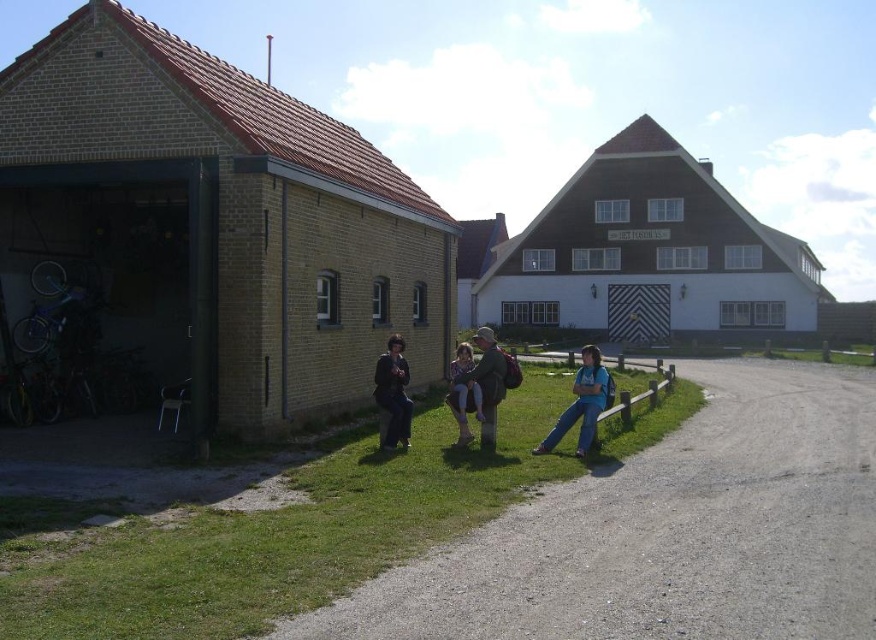
Is blue jeans at lower right positioned at the back of dark brown leather jacket at center?

No.

Based on the photo, which of these two, blue jeans at lower right or dark brown leather jacket at center, stands shorter?

blue jeans at lower right is shorter.

I want to click on blue jeans at lower right, so click(x=581, y=403).

At what (x,y) coordinates should I click in order to perform the action: click on blue jeans at lower right. Please return your answer as a coordinate pair (x, y). Looking at the image, I should click on (581, 403).

Is blue jeans at lower right behind denim jacket at center?

No.

Is point (576, 452) positioned before point (467, 403)?

Yes, point (576, 452) is in front of point (467, 403).

Measure the distance between blue jeans at lower right and camera.

The distance of blue jeans at lower right from camera is 10.42 meters.

Identify the location of blue jeans at lower right. pyautogui.click(x=581, y=403).

Which is below, matte gray jacket at center or denim jacket at center?

denim jacket at center

Which of these two, matte gray jacket at center or denim jacket at center, stands taller?

matte gray jacket at center is taller.

This screenshot has height=640, width=876. What are the coordinates of `matte gray jacket at center` in the screenshot? It's located at (479, 388).